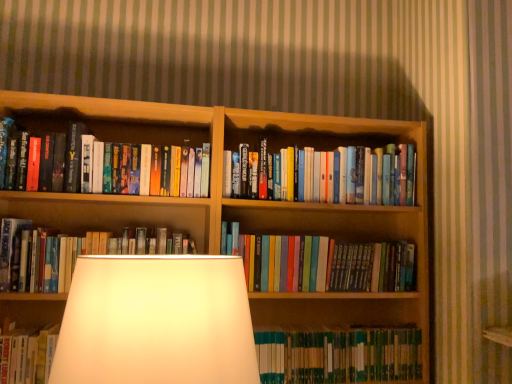
Question: Would you say green hardcover book at center, the 1th book ordered from the bottom, is inside or outside hardcover books at left, the first book when ordered from top to bottom?

Choices:
 (A) outside
 (B) inside

Answer: (A)

Question: Considering the positions of green hardcover book at center, acting as the fifth book starting from the top, and hardcover books at left, marked as the fifth book in a bottom-to-top arrangement, in the image, is green hardcover book at center, acting as the fifth book starting from the top, taller or shorter than hardcover books at left, marked as the fifth book in a bottom-to-top arrangement,?

Choices:
 (A) tall
 (B) short

Answer: (B)

Question: Which is farther from the hardcover books at center, which is counted as the second book, starting from the top?

Choices:
 (A) hardcover books at center, the 4th book viewed from the top
 (B) wooden bookcase at center
 (C) hardcover books at center, positioned as the third book in bottom-to-top order
 (D) green hardcover book at center, acting as the fifth book starting from the top
 (E) hardcover books at left, the first book when ordered from top to bottom

Answer: (C)

Question: Which object is positioned farthest from the hardcover books at center, the 2th book positioned from the bottom?

Choices:
 (A) hardcover books at center, positioned as the third book in bottom-to-top order
 (B) wooden bookcase at center
 (C) green hardcover book at center, acting as the fifth book starting from the top
 (D) hardcover books at left, marked as the fifth book in a bottom-to-top arrangement
 (E) hardcover books at center, positioned as the fourth book in bottom-to-top order

Answer: (A)